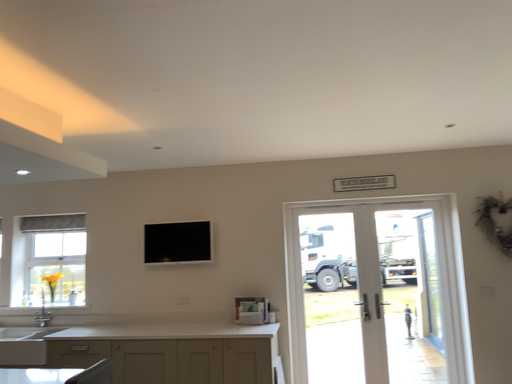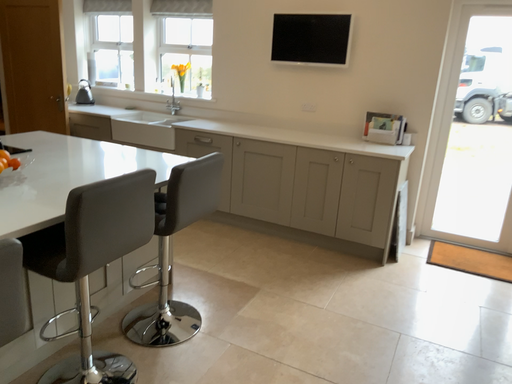
Question: How did the camera likely rotate when shooting the video?

Choices:
 (A) rotated upward
 (B) rotated downward

Answer: (B)